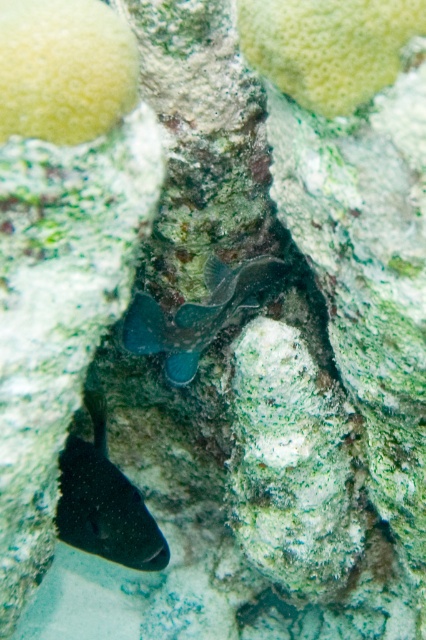
Image resolution: width=426 pixels, height=640 pixels. What do you see at coordinates (104, 500) in the screenshot?
I see `shiny black fish at lower left` at bounding box center [104, 500].

Is shiny black fish at lower left shorter than shiny blue fish at center?

Incorrect, shiny black fish at lower left's height does not fall short of shiny blue fish at center's.

The width and height of the screenshot is (426, 640). I want to click on shiny black fish at lower left, so click(104, 500).